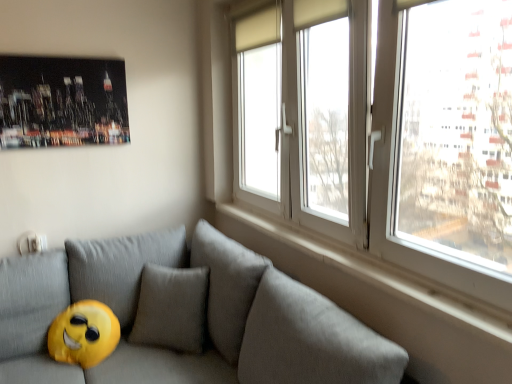
This screenshot has height=384, width=512. I want to click on free space below white plastic window at upper right (from a real-world perspective), so click(352, 259).